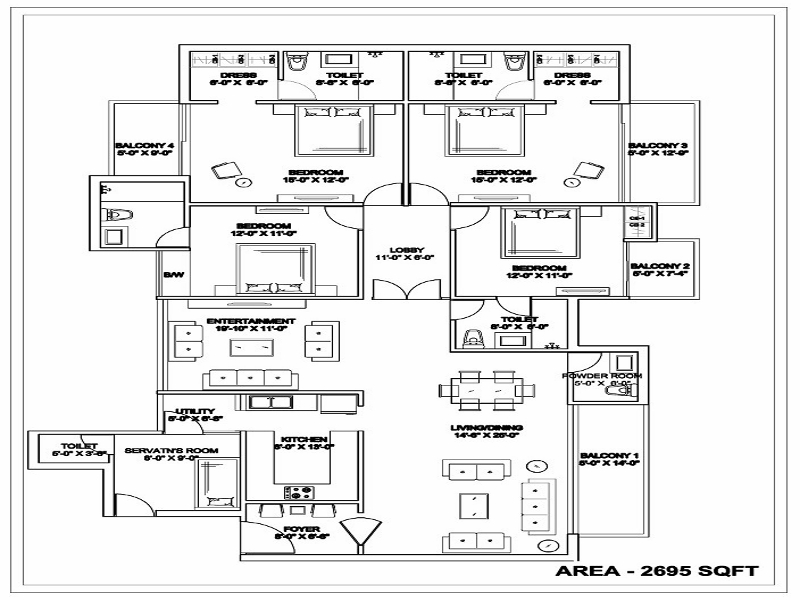
This screenshot has height=600, width=800. What are the coordinates of `bedroom` in the screenshot? It's located at (322, 172), (262, 224), (494, 172).